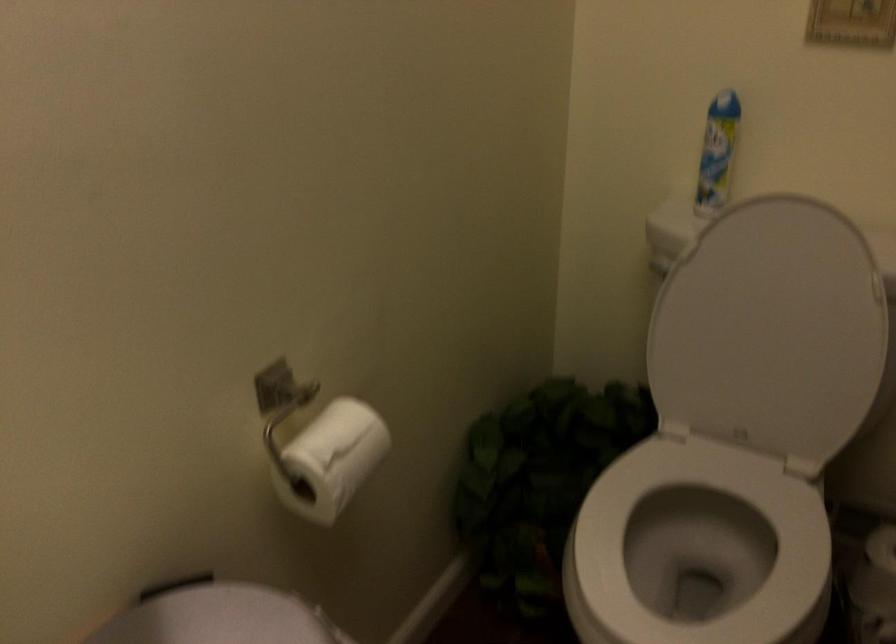
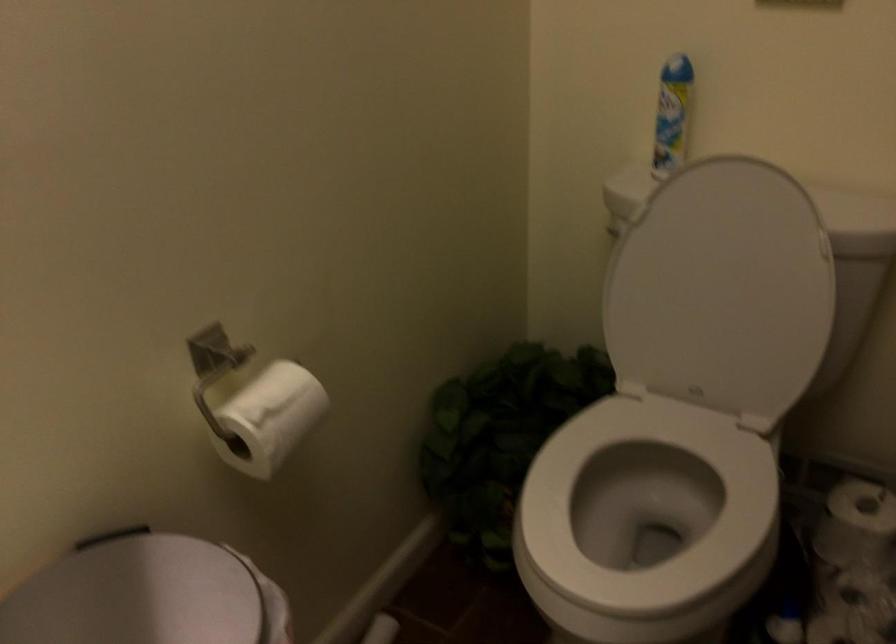
The point at (716,156) is marked in the first image. Where is the corresponding point in the second image?

(672, 114)